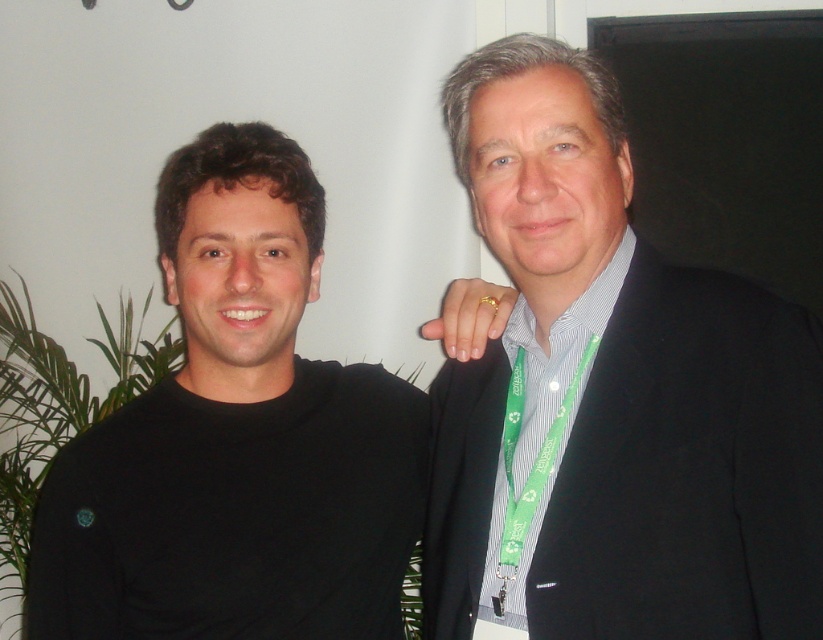
Question: Is black matte shirt at left closer to camera compared to black wool suit at right?

Choices:
 (A) yes
 (B) no

Answer: (B)

Question: Among these objects, which one is farthest from the camera?

Choices:
 (A) black wool suit at right
 (B) black matte shirt at left

Answer: (B)

Question: Among these objects, which one is farthest from the camera?

Choices:
 (A) black matte shirt at left
 (B) black wool suit at right

Answer: (A)

Question: Is the position of black matte shirt at left more distant than that of black wool suit at right?

Choices:
 (A) yes
 (B) no

Answer: (A)

Question: Is black matte shirt at left further to the viewer compared to black wool suit at right?

Choices:
 (A) no
 (B) yes

Answer: (B)